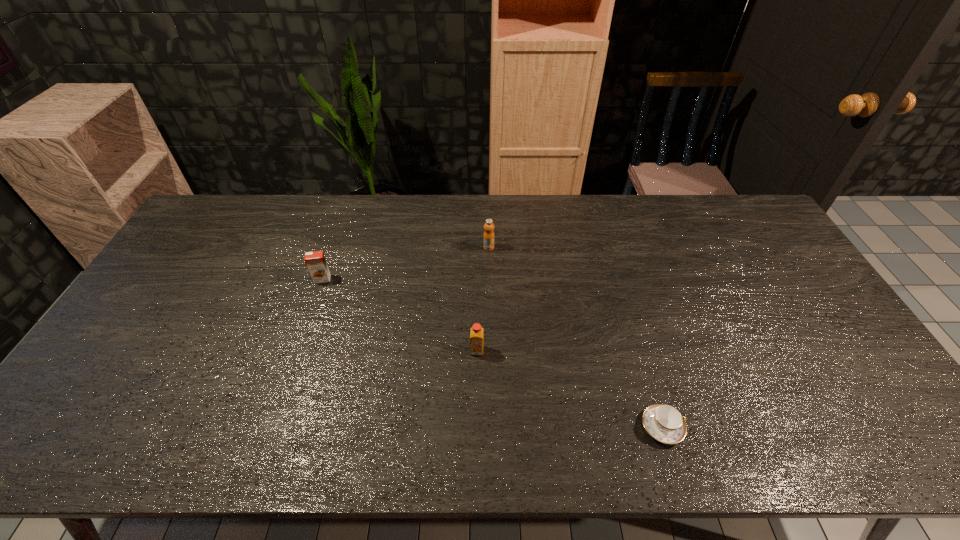
The image size is (960, 540). Identify the location of the farthest object. (488, 238).

The image size is (960, 540). I want to click on the second object from right to left, so click(488, 238).

Find the location of a particular element. This screenshot has width=960, height=540. the second nearest object is located at coordinates (476, 331).

The height and width of the screenshot is (540, 960). In order to click on the third object from right to left in this screenshot , I will do `click(476, 331)`.

The width and height of the screenshot is (960, 540). What are the coordinates of `the leftmost orange juice` in the screenshot? It's located at (315, 261).

Identify the location of the second farthest object. (315, 261).

Where is `the nearest object`? the nearest object is located at coordinates (663, 422).

The height and width of the screenshot is (540, 960). I want to click on the rightmost object, so click(663, 422).

I want to click on vacant space located on the front label of the third object from left to right, so click(491, 314).

What are the coordinates of `vacant space located 0.230m on the front and back of the second nearest object` in the screenshot? It's located at (476, 440).